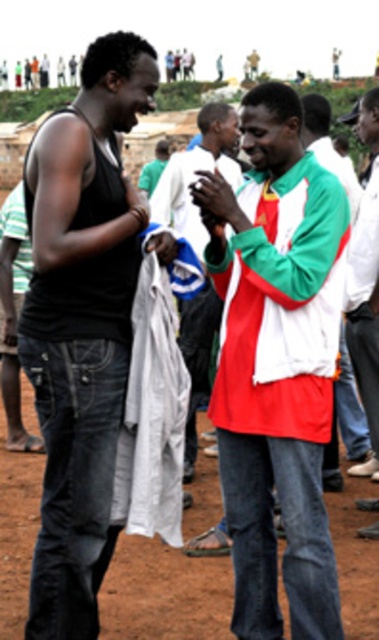
In the scene shown: You are standing in a crowded area and want to reach the two points marked in the image. Which point, point (234, 396) or point (341, 588), is closer to you?

Point (234, 396) is closer to the viewer than point (341, 588), so you should go to point (234, 396) first.

You are standing in the scene and want to walk from the black denim jeans at left to the dirt field at lower center. Is the path clear?

The black denim jeans at left is in front of dirt field at lower center, so the path is blocked by the black denim jeans at left.